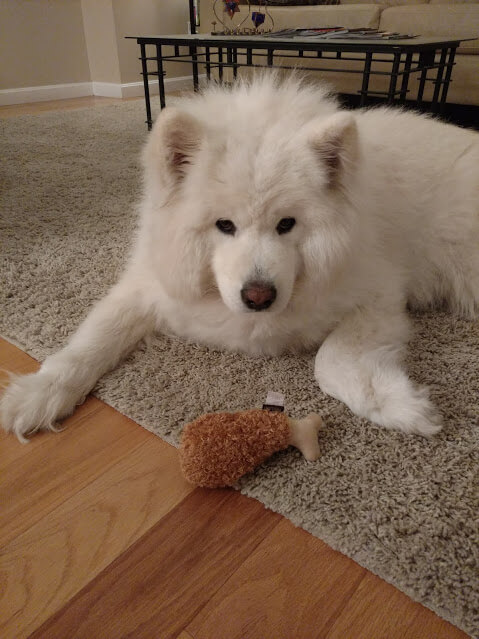
I want to click on white tan couch, so click(437, 24).